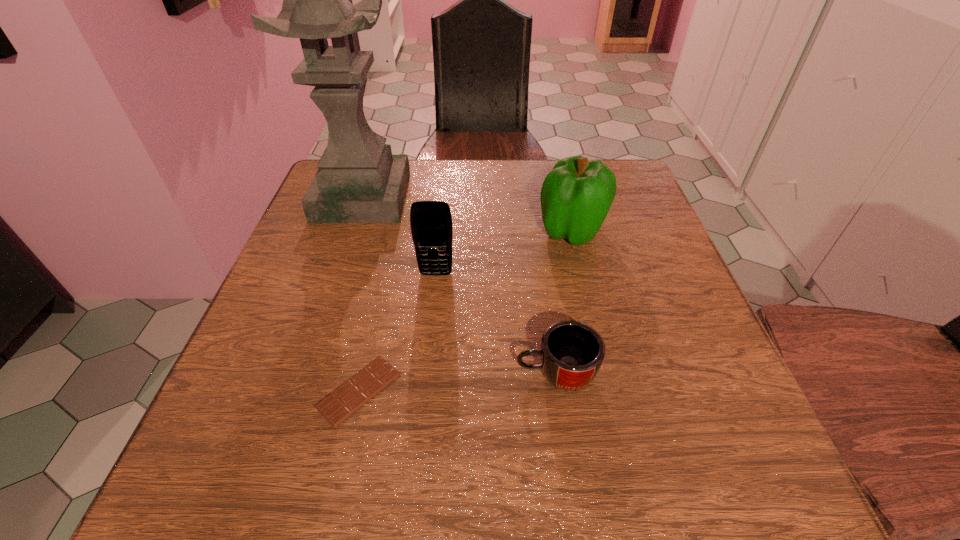
Locate an element on the screen. vacant space located 0.290m on the side of the mug with the handle is located at coordinates (337, 374).

This screenshot has height=540, width=960. In order to click on vacant space positioned 0.280m on the side of the mug with the handle in this screenshot , I will do `click(343, 374)`.

You are a GUI agent. You are given a task and a screenshot of the screen. Output one action in this format:
    pyautogui.click(x=<x>, y=<y>)
    Task: Click on the free space located 0.140m on the right of the shortest object
    
    Given the screenshot: What is the action you would take?
    pyautogui.click(x=488, y=390)

What are the coordinates of `sculpture at the far edge` in the screenshot? It's located at (358, 180).

Image resolution: width=960 pixels, height=540 pixels. I want to click on bell pepper that is at the far edge, so click(x=576, y=196).

Find the location of a particular element. The height and width of the screenshot is (540, 960). sculpture at the left edge is located at coordinates (358, 180).

Where is `chocolate bar that is positioned at the left edge`? Image resolution: width=960 pixels, height=540 pixels. chocolate bar that is positioned at the left edge is located at coordinates (336, 407).

This screenshot has width=960, height=540. I want to click on object that is at the right edge, so click(x=576, y=196).

The width and height of the screenshot is (960, 540). Find the location of `object that is at the far left corner`. object that is at the far left corner is located at coordinates (358, 180).

At what (x,y) coordinates should I click in order to perform the action: click on object positioned at the far right corner. Please return your answer as a coordinate pair (x, y). The height and width of the screenshot is (540, 960). Looking at the image, I should click on (576, 196).